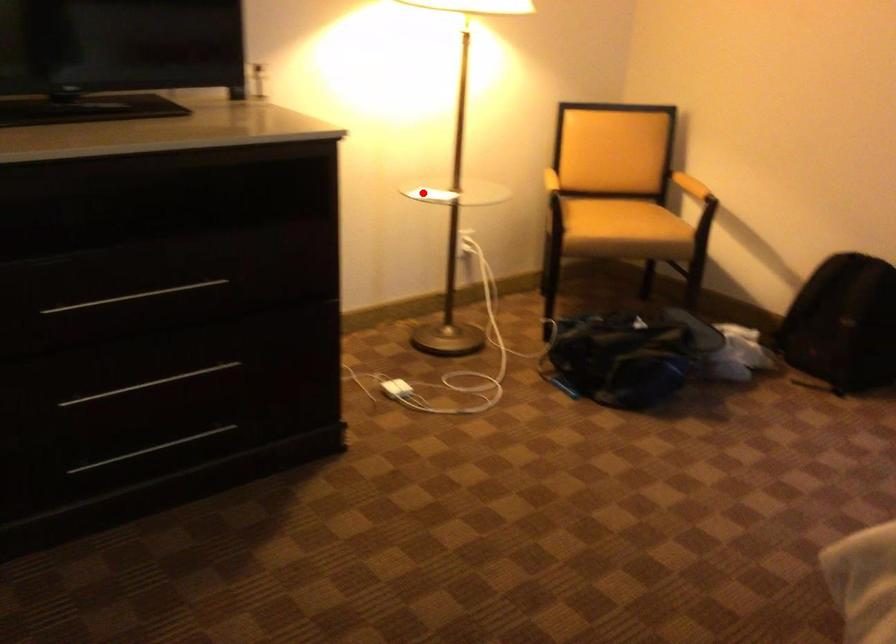
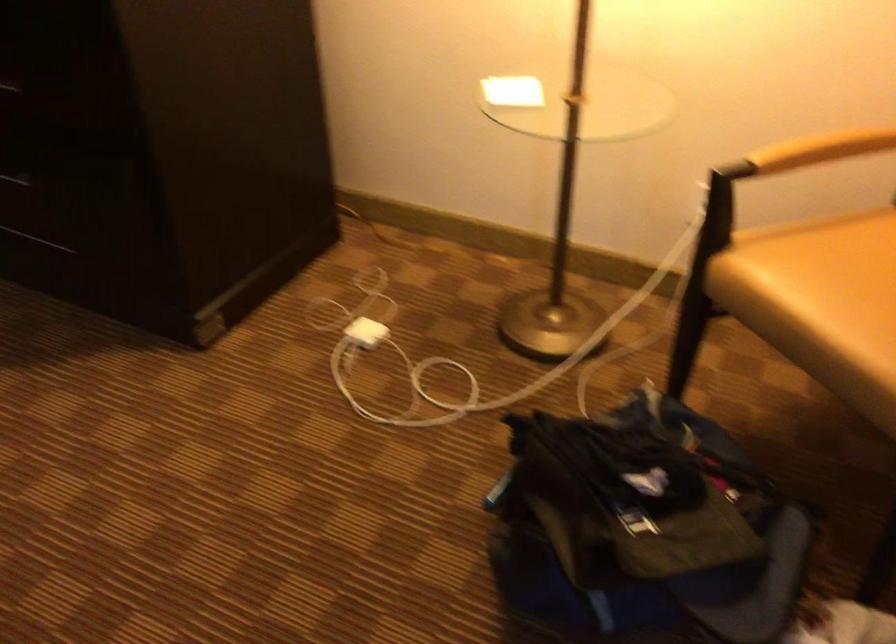
Question: I am providing you with two images of the same scene from different viewpoints. A red point is shown in image1. For the corresponding object point in image2, is it positioned nearer or farther from the camera?

Choices:
 (A) Nearer
 (B) Farther

Answer: (A)